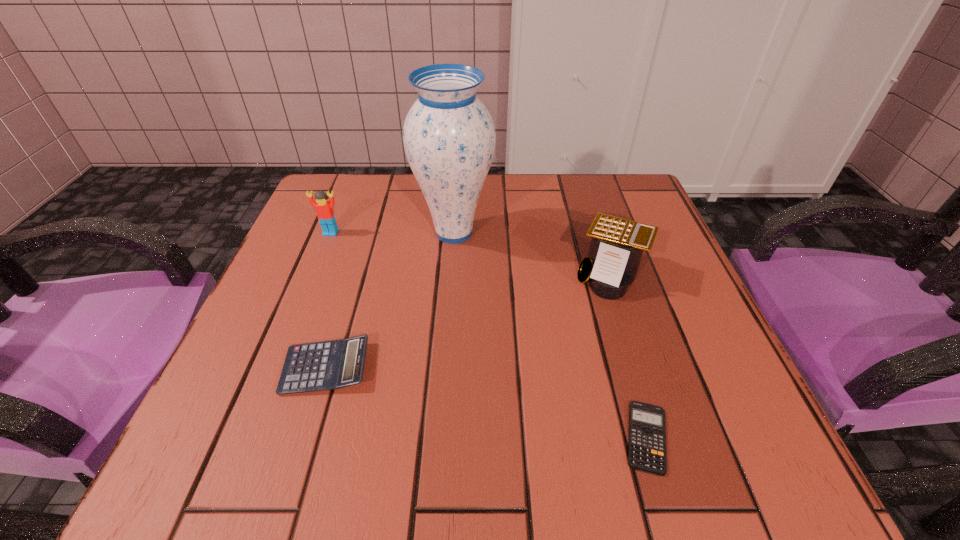
In the image, there is a desktop. Identify the location of free region at the far edge. (584, 215).

This screenshot has height=540, width=960. In the image, there is a desktop. Find the location of `vacant space at the near edge`. vacant space at the near edge is located at coordinates (339, 421).

Identify the location of free space at the left edge of the desktop. (252, 409).

Find the location of a particular element. The width and height of the screenshot is (960, 540). vacant space at the right edge of the desktop is located at coordinates (673, 293).

The image size is (960, 540). In order to click on vacant space at the far left corner of the desktop in this screenshot , I will do `click(380, 194)`.

In the image, there is a desktop. Find the location of `free region at the near left corner`. free region at the near left corner is located at coordinates (241, 466).

Where is `vacant space at the far right corner of the desktop`? vacant space at the far right corner of the desktop is located at coordinates (598, 180).

Locate an element on the screen. The width and height of the screenshot is (960, 540). vacant space at the near right corner of the desktop is located at coordinates (716, 463).

The image size is (960, 540). Identify the location of vacant area between the Lego and the third object from right to left. (393, 233).

Where is `vacant space that's between the leftmost calculator and the vase`? The image size is (960, 540). vacant space that's between the leftmost calculator and the vase is located at coordinates (390, 300).